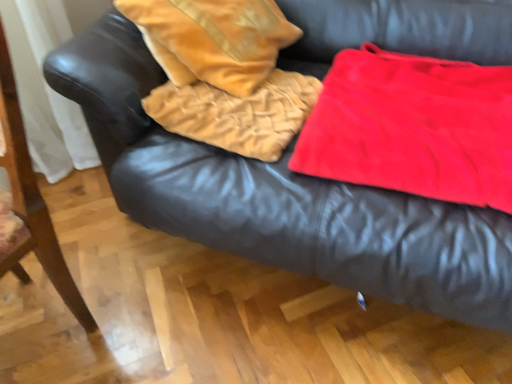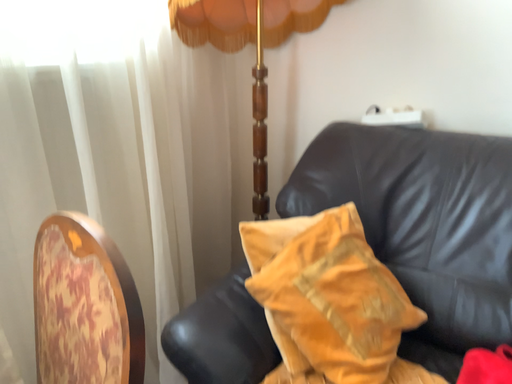
Question: How did the camera likely rotate when shooting the video?

Choices:
 (A) rotated left
 (B) rotated right

Answer: (A)